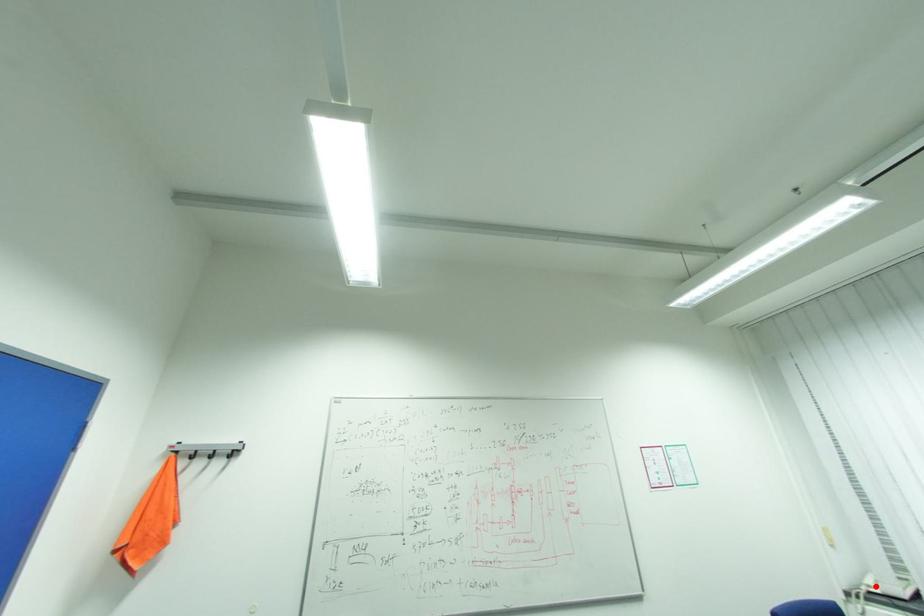
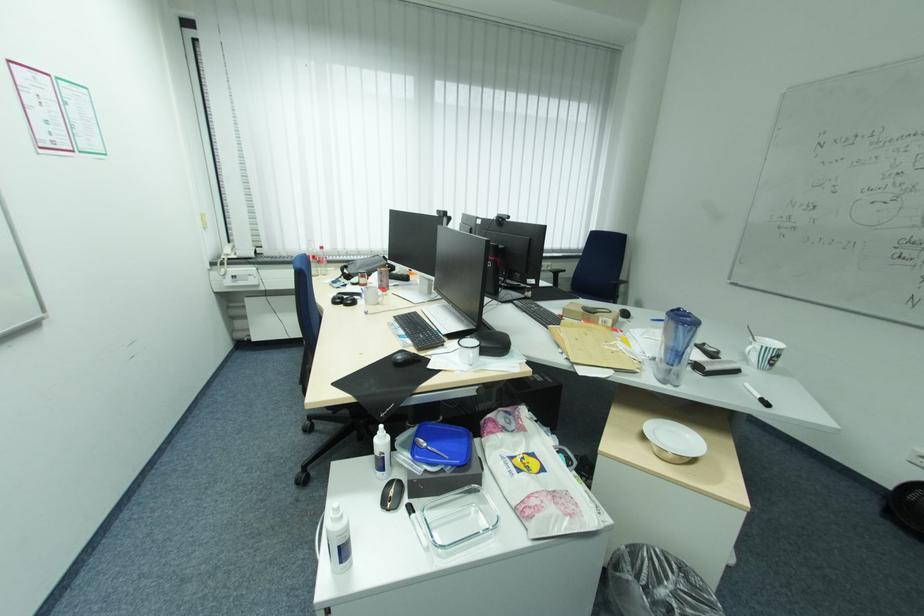
Find the pixel in the second image that matches the highlighted location in the first image.

(234, 254)